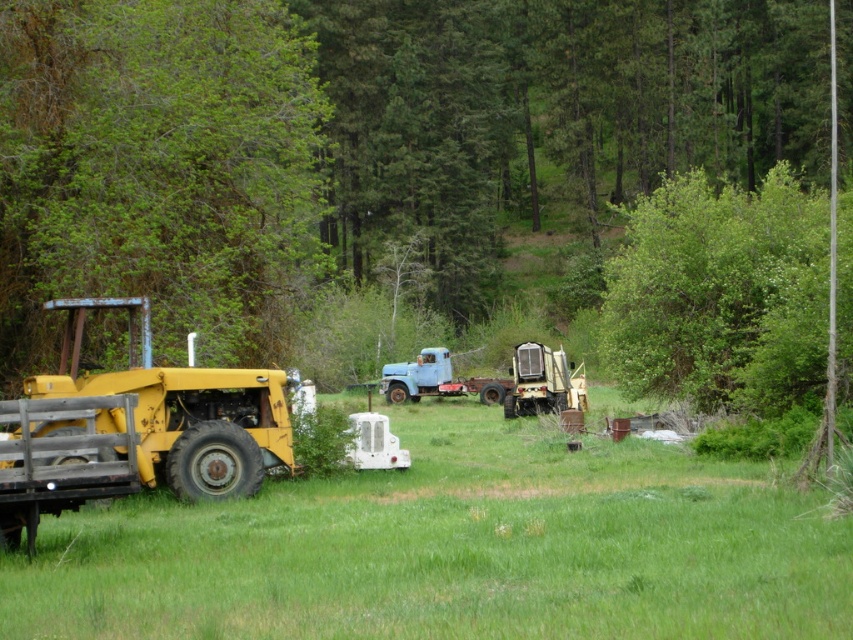
Question: Which of the following is the farthest from the observer?

Choices:
 (A) green leafy tree at left
 (B) green leafy tree at center
 (C) green grassy field at lower left
 (D) light blue matte truck at center

Answer: (D)

Question: Estimate the real-world distances between objects in this image. Which object is closer to the green leafy tree at left?

Choices:
 (A) green leafy tree at center
 (B) light blue matte truck at center
 (C) green grassy field at lower left

Answer: (A)

Question: Where is green grassy field at lower left located in relation to light blue matte truck at center in the image?

Choices:
 (A) above
 (B) below

Answer: (A)

Question: Which of the following is the farthest from the observer?

Choices:
 (A) (436, 349)
 (B) (3, 291)

Answer: (A)

Question: Does green leafy tree at left lie in front of light blue matte truck at center?

Choices:
 (A) yes
 (B) no

Answer: (A)

Question: Observing the image, what is the correct spatial positioning of green grassy field at lower left in reference to light blue matte truck at center?

Choices:
 (A) left
 (B) right

Answer: (B)